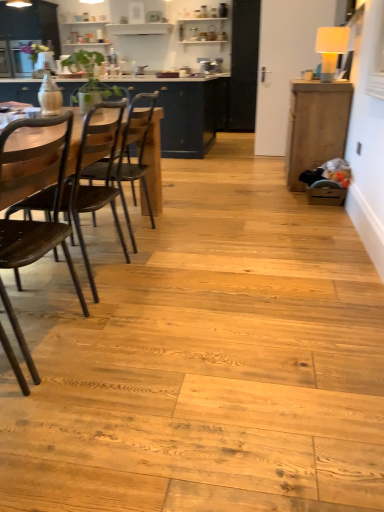
Question: Is matte dark wood cabinet at center, the first cabinetry positioned from the left, oriented away from dark brown wood chair at left, acting as the first chair starting from the front?

Choices:
 (A) yes
 (B) no

Answer: (B)

Question: Considering the relative positions of matte dark wood cabinet at center, the second cabinetry positioned from the front, and dark brown wood chair at left, which is counted as the 3th chair, starting from the back, in the image provided, is matte dark wood cabinet at center, the second cabinetry positioned from the front, to the left of dark brown wood chair at left, which is counted as the 3th chair, starting from the back, from the viewer's perspective?

Choices:
 (A) no
 (B) yes

Answer: (B)

Question: Can you confirm if matte dark wood cabinet at center, arranged as the 1th cabinetry when viewed from the back, is taller than dark brown wood chair at left, acting as the first chair starting from the front?

Choices:
 (A) yes
 (B) no

Answer: (A)

Question: Does matte dark wood cabinet at center, the first cabinetry positioned from the left, have a smaller size compared to dark brown wood chair at left, acting as the first chair starting from the front?

Choices:
 (A) yes
 (B) no

Answer: (B)

Question: Does matte dark wood cabinet at center, arranged as the 1th cabinetry when viewed from the back, have a lesser height compared to dark brown wood chair at left, which is counted as the 3th chair, starting from the back?

Choices:
 (A) yes
 (B) no

Answer: (B)

Question: Relative to wooden cabinet at right, which is the second cabinetry in back-to-front order, is dark brown wood chair at left, which is counted as the 3th chair, starting from the back, in front or behind?

Choices:
 (A) front
 (B) behind

Answer: (A)

Question: From a real-world perspective, is dark brown wood chair at left, which is counted as the 3th chair, starting from the back, above or below wooden cabinet at right, acting as the 2th cabinetry starting from the left?

Choices:
 (A) below
 (B) above

Answer: (B)

Question: Would you say dark brown wood chair at left, acting as the first chair starting from the front, is to the left or to the right of wooden cabinet at right, which is the second cabinetry in back-to-front order, in the picture?

Choices:
 (A) right
 (B) left

Answer: (B)

Question: Looking at the image, does dark brown wood chair at left, acting as the first chair starting from the front, seem bigger or smaller compared to wooden cabinet at right, which is the second cabinetry in back-to-front order?

Choices:
 (A) big
 (B) small

Answer: (B)

Question: Considering their positions, is wooden chair at left, positioned as the 3th chair in front-to-back order, located in front of or behind dark brown wood chair at left, which is counted as the 3th chair, starting from the back?

Choices:
 (A) behind
 (B) front

Answer: (A)

Question: Is wooden chair at left, acting as the first chair starting from the back, spatially inside dark brown wood chair at left, which is counted as the 3th chair, starting from the back, or outside of it?

Choices:
 (A) inside
 (B) outside

Answer: (B)

Question: Considering the positions of wooden chair at left, positioned as the 3th chair in front-to-back order, and dark brown wood chair at left, which is counted as the 3th chair, starting from the back, in the image, is wooden chair at left, positioned as the 3th chair in front-to-back order, bigger or smaller than dark brown wood chair at left, which is counted as the 3th chair, starting from the back,?

Choices:
 (A) big
 (B) small

Answer: (A)

Question: Based on their positions, is wooden chair at left, positioned as the 3th chair in front-to-back order, located to the left or right of dark brown wood chair at left, which is counted as the 3th chair, starting from the back?

Choices:
 (A) left
 (B) right

Answer: (B)

Question: Choose the correct answer: Is wooden cabinet at right, which is the second cabinetry in back-to-front order, inside dark brown wood chair at left, which is counted as the 3th chair, starting from the back, or outside it?

Choices:
 (A) inside
 (B) outside

Answer: (B)

Question: Is wooden cabinet at right, acting as the 2th cabinetry starting from the left, taller or shorter than dark brown wood chair at left, which is counted as the 3th chair, starting from the back?

Choices:
 (A) short
 (B) tall

Answer: (A)